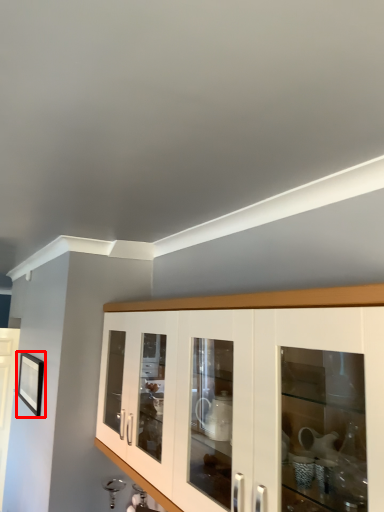
Question: From the image's perspective, what is the correct spatial relationship of picture frame (annotated by the red box) in relation to cabinetry?

Choices:
 (A) below
 (B) above

Answer: (A)